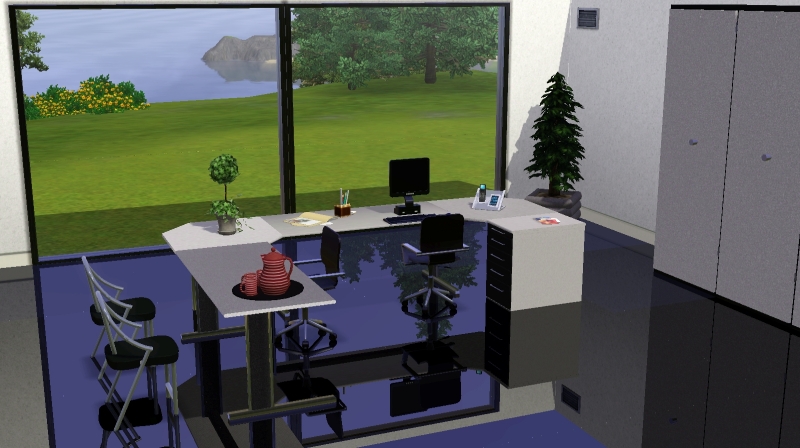
Where is `wall`? This screenshot has height=448, width=800. wall is located at coordinates (618, 135), (13, 226).